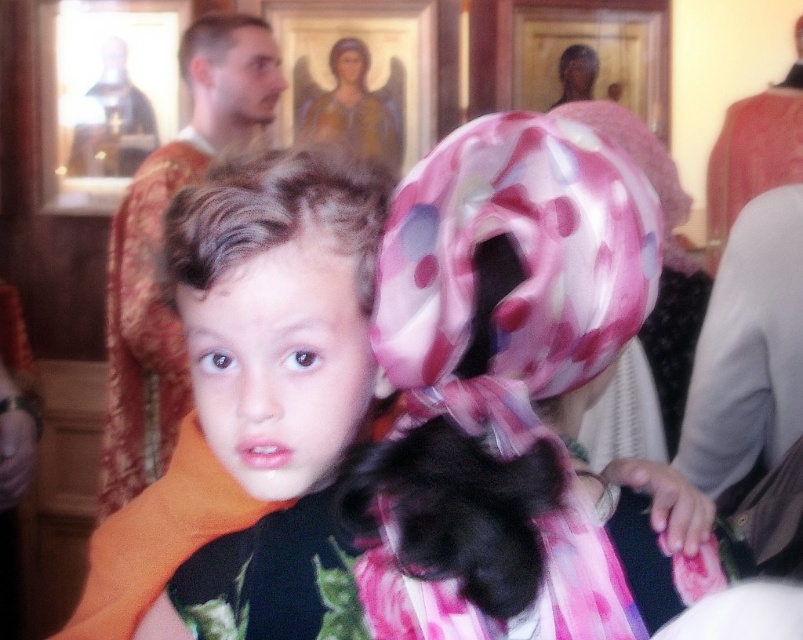
You are standing in a religious or ceremonial setting and see two points marked in the scene. Which point is closer to you, point (214, 17) or point (202, 52)?

Point (214, 17) is closer to you than point (202, 52).

You are an observer in the scene. You notice the matte orange scarf at center and the smooth skin face at upper left. Which object is positioned lower in the image?

The matte orange scarf at center is located below the smooth skin face at upper left, so it is positioned lower in the image.